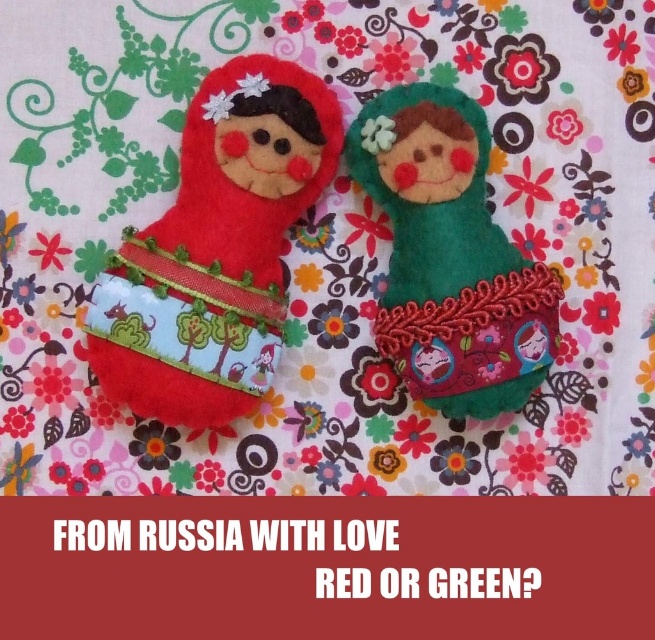
You are standing in front of the two Matryoshka dolls and want to touch the closest point to you. Which point should you choose between point (172, 284) and point (367, 150)?

Point (172, 284) is closer to the viewer than point (367, 150), so you should choose point (172, 284).

You are arranging a display of dolls and need to place a new doll between the matte felt doll at left and the green felt doll at center. Based on their current positions, where should you place the new doll?

The matte felt doll at left is located above the green felt doll at center, so you should place the new doll between them by positioning it below the matte felt doll at left and above the green felt doll at center.